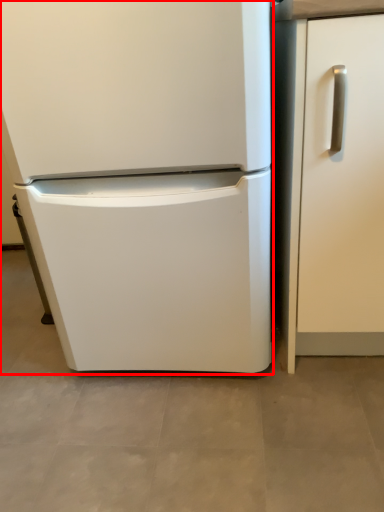
Question: From the image's perspective, what is the correct spatial positioning of refrigerator (annotated by the red box) in reference to door?

Choices:
 (A) below
 (B) above

Answer: (B)